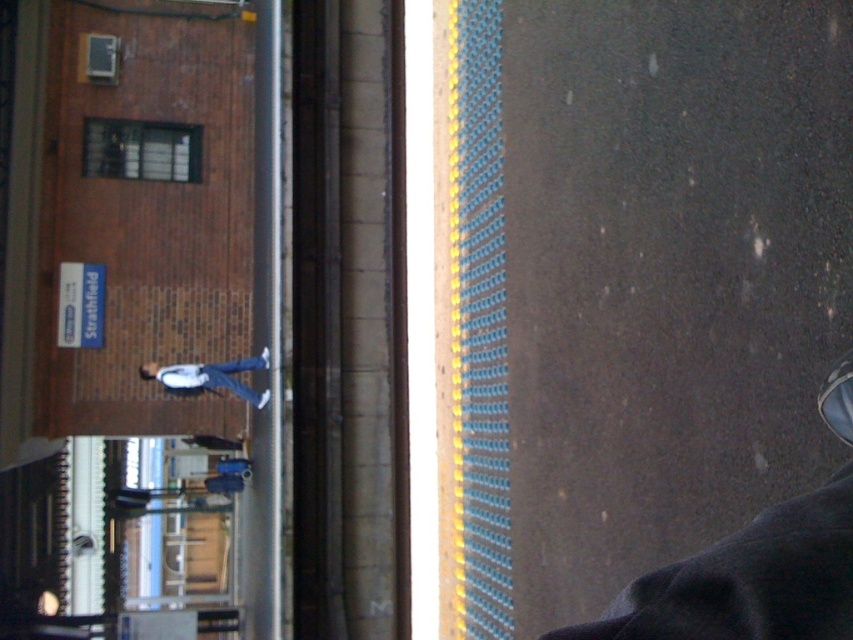
Question: Observing the image, what is the correct spatial positioning of brick textured window at upper left in reference to light blue jeans at center?

Choices:
 (A) above
 (B) below

Answer: (A)

Question: Can you confirm if brick textured window at upper left is bigger than light blue jeans at center?

Choices:
 (A) no
 (B) yes

Answer: (A)

Question: Which of the following is the closest to the observer?

Choices:
 (A) light blue jeans at center
 (B) brick textured window at upper left

Answer: (A)

Question: Does brick textured window at upper left appear over light blue jeans at center?

Choices:
 (A) yes
 (B) no

Answer: (A)

Question: Which of the following is the closest to the observer?

Choices:
 (A) (149, 122)
 (B) (259, 362)

Answer: (B)